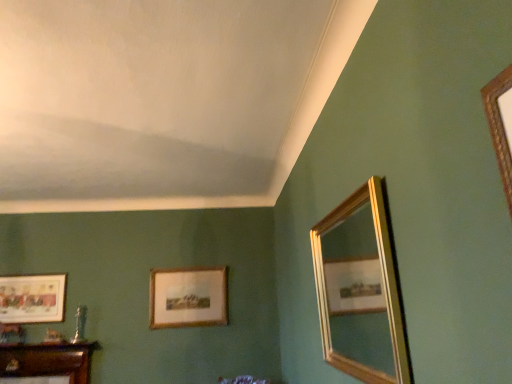
Question: Could you tell me if matte gold picture frame at lower left, arranged as the second picture frame when viewed from the right, is turned towards gold-framed mirror at right?

Choices:
 (A) no
 (B) yes

Answer: (A)

Question: From a real-world perspective, is matte gold picture frame at lower left, arranged as the second picture frame when viewed from the right, under gold-framed mirror at right?

Choices:
 (A) no
 (B) yes

Answer: (A)

Question: Can we say matte gold picture frame at lower left, arranged as the first picture frame when viewed from the left, lies outside gold-framed mirror at right?

Choices:
 (A) yes
 (B) no

Answer: (A)

Question: Does matte gold picture frame at lower left, arranged as the first picture frame when viewed from the left, appear on the left side of gold-framed mirror at right?

Choices:
 (A) yes
 (B) no

Answer: (A)

Question: Is matte gold picture frame at lower left, arranged as the second picture frame when viewed from the right, turned away from gold-framed mirror at right?

Choices:
 (A) yes
 (B) no

Answer: (B)

Question: In terms of width, does gold-framed picture at center, acting as the first picture frame starting from the right, look wider or thinner when compared to matte gold picture frame at lower left, arranged as the second picture frame when viewed from the right?

Choices:
 (A) thin
 (B) wide

Answer: (B)

Question: Considering the relative positions of gold-framed picture at center, which appears as the second picture frame when viewed from the left, and matte gold picture frame at lower left, arranged as the first picture frame when viewed from the left, in the image provided, is gold-framed picture at center, which appears as the second picture frame when viewed from the left, to the left or to the right of matte gold picture frame at lower left, arranged as the first picture frame when viewed from the left,?

Choices:
 (A) left
 (B) right

Answer: (B)

Question: Is gold-framed picture at center, which appears as the second picture frame when viewed from the left, situated inside matte gold picture frame at lower left, arranged as the first picture frame when viewed from the left, or outside?

Choices:
 (A) inside
 (B) outside

Answer: (B)

Question: From the image's perspective, is gold-framed picture at center, acting as the first picture frame starting from the right, positioned above or below matte gold picture frame at lower left, arranged as the second picture frame when viewed from the right?

Choices:
 (A) below
 (B) above

Answer: (A)

Question: Is gold-framed mirror at right wider or thinner than matte gold picture frame at lower left, arranged as the first picture frame when viewed from the left?

Choices:
 (A) thin
 (B) wide

Answer: (B)

Question: Would you say gold-framed mirror at right is to the left or to the right of matte gold picture frame at lower left, arranged as the first picture frame when viewed from the left, in the picture?

Choices:
 (A) right
 (B) left

Answer: (A)

Question: From a real-world perspective, is gold-framed mirror at right positioned above or below matte gold picture frame at lower left, arranged as the second picture frame when viewed from the right?

Choices:
 (A) above
 (B) below

Answer: (B)

Question: Considering the positions of point (361, 284) and point (1, 314), is point (361, 284) closer or farther from the camera than point (1, 314)?

Choices:
 (A) closer
 (B) farther

Answer: (B)

Question: From the image's perspective, is gold-framed picture at center, acting as the first picture frame starting from the right, above or below gold-framed mirror at right?

Choices:
 (A) above
 (B) below

Answer: (B)

Question: Is gold-framed picture at center, which appears as the second picture frame when viewed from the left, situated inside gold-framed mirror at right or outside?

Choices:
 (A) outside
 (B) inside

Answer: (A)